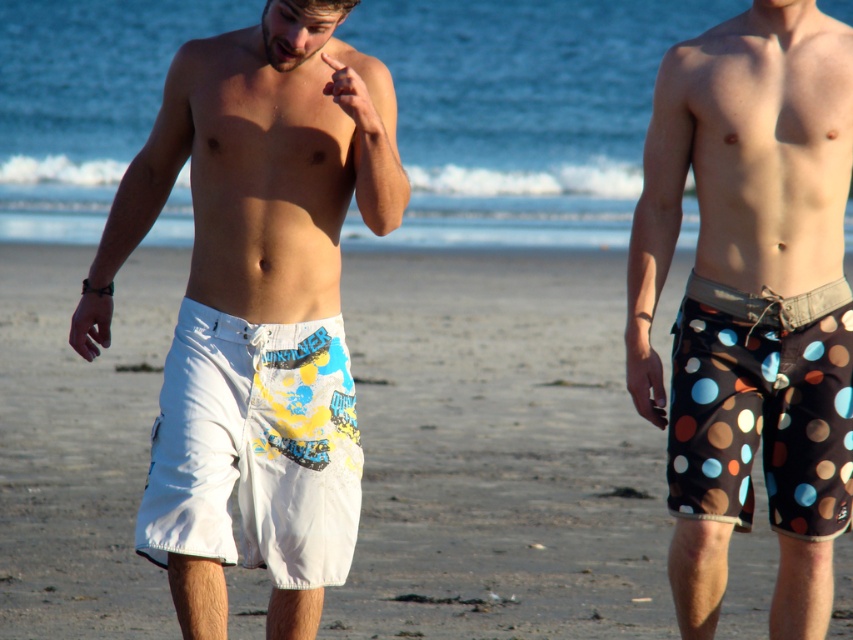
From the picture: Is white cotton shorts at center closer to the viewer compared to brown polka dot fabric shorts at right?

That is True.

Is point (218, 381) less distant than point (756, 312)?

Yes.

The image size is (853, 640). I want to click on white cotton shorts at center, so click(x=254, y=449).

Between polka dot fabric shorts at center and white printed boardshorts at center, which one has less height?

With less height is white printed boardshorts at center.

Does polka dot fabric shorts at center appear over white printed boardshorts at center?

No.

Describe the element at coordinates (743, 166) in the screenshot. I see `polka dot fabric shorts at center` at that location.

The width and height of the screenshot is (853, 640). I want to click on polka dot fabric shorts at center, so click(743, 166).

Which is behind, point (364, 307) or point (796, 454)?

Positioned behind is point (364, 307).

Who is taller, white fabric shorts at center or brown polka dot fabric shorts at right?

With more height is white fabric shorts at center.

Does point (486, 630) lie behind point (779, 323)?

Yes, point (486, 630) is behind point (779, 323).

At what (x,y) coordinates should I click in order to perform the action: click on white fabric shorts at center. Please return your answer as a coordinate pair (x, y). Looking at the image, I should click on (498, 451).